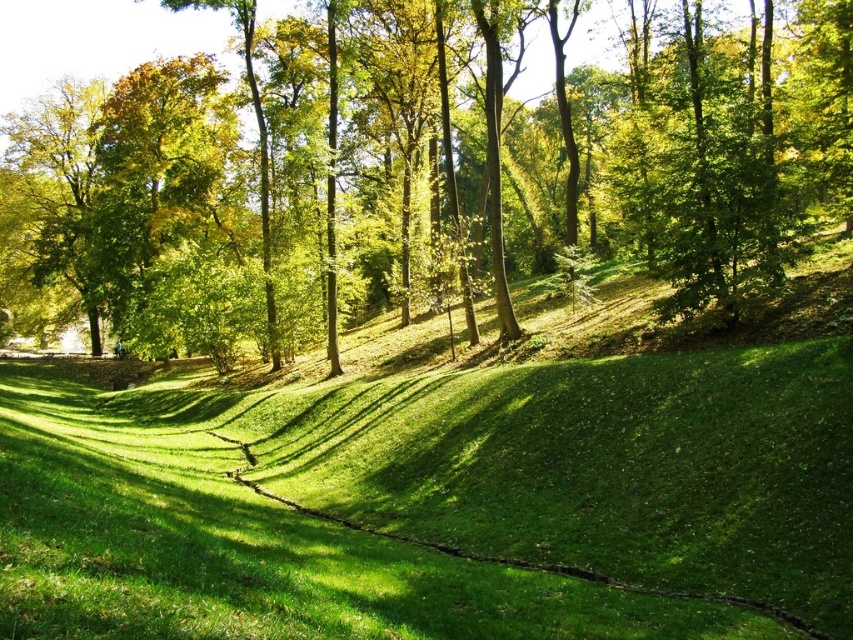
You are standing in the park and want to take a photo of the green leafy tree at upper center and the green grassy at center. Which object should you focus on first to ensure both are in focus?

You should focus on the green leafy tree at upper center first because it is closer to you than the green grassy at center, so adjusting focus from near to far will help both be in focus.

You are a hiker standing at the edge of the park and see the green leafy tree at upper center and the green grassy at center. Which object is located to the left of the other?

The green leafy tree at upper center is positioned on the left side of green grassy at center.